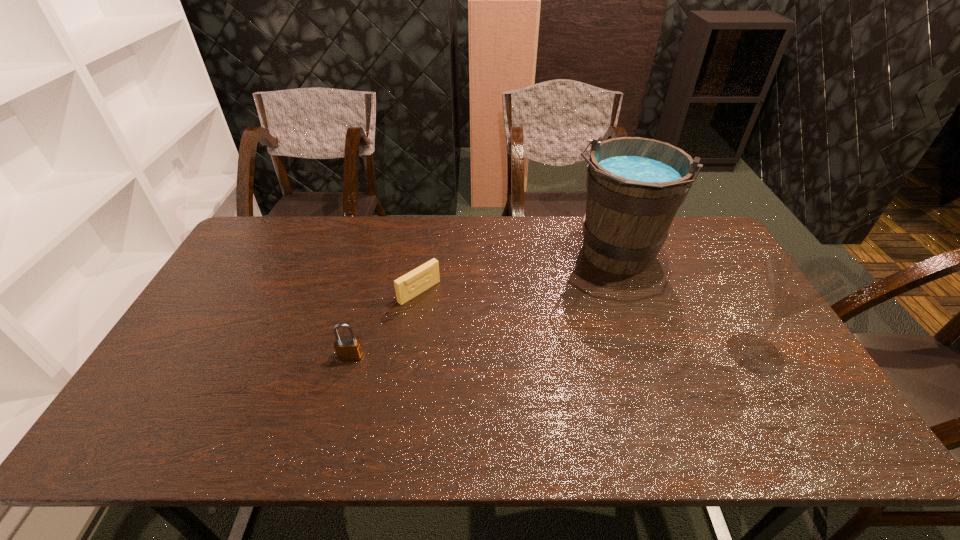
In order to click on vacant space located with a handle on the side of the wine bucket in this screenshot , I will do `click(575, 330)`.

You are a GUI agent. You are given a task and a screenshot of the screen. Output one action in this format:
    pyautogui.click(x=<x>, y=<y>)
    Task: Click on the vacant space situated with a handle on the side of the wine bucket
    
    Given the screenshot: What is the action you would take?
    pyautogui.click(x=550, y=377)

You are a GUI agent. You are given a task and a screenshot of the screen. Output one action in this format:
    pyautogui.click(x=<x>, y=<y>)
    Task: Click on the vacant space located with a handle on the side of the wine bucket
    Image resolution: width=960 pixels, height=540 pixels.
    Given the screenshot: What is the action you would take?
    pyautogui.click(x=577, y=327)

In order to click on vacant space located at the front of the shortest object with spools in this screenshot , I will do `click(470, 333)`.

Where is `free location located at the front of the shortest object with spools`? free location located at the front of the shortest object with spools is located at coordinates (527, 379).

Where is `vacant space located 0.330m at the front of the shortest object with spools`? Image resolution: width=960 pixels, height=540 pixels. vacant space located 0.330m at the front of the shortest object with spools is located at coordinates (513, 367).

Locate an element on the screen. object that is at the far edge is located at coordinates (635, 185).

Where is `object that is positioned at the near edge`? The width and height of the screenshot is (960, 540). object that is positioned at the near edge is located at coordinates (796, 283).

I want to click on object at the right edge, so click(796, 283).

Find the location of `object at the near right corner`. object at the near right corner is located at coordinates (796, 283).